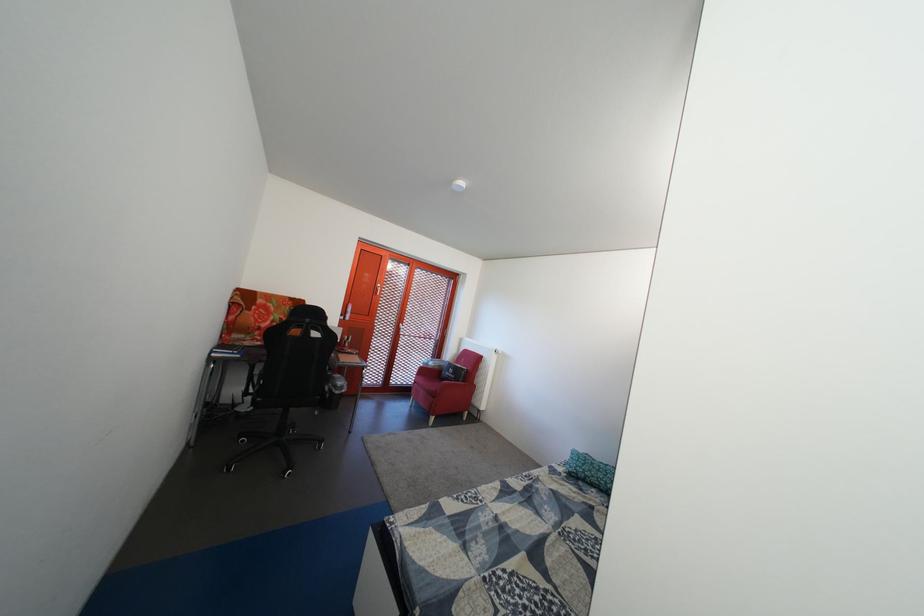
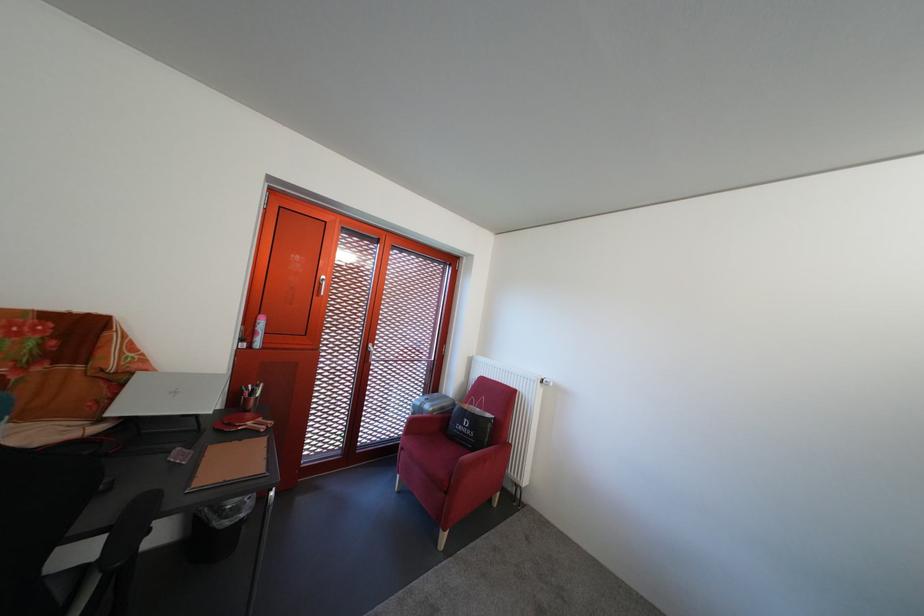
The point at [442,370] is marked in the first image. Where is the corresponding point in the second image?

(439, 413)